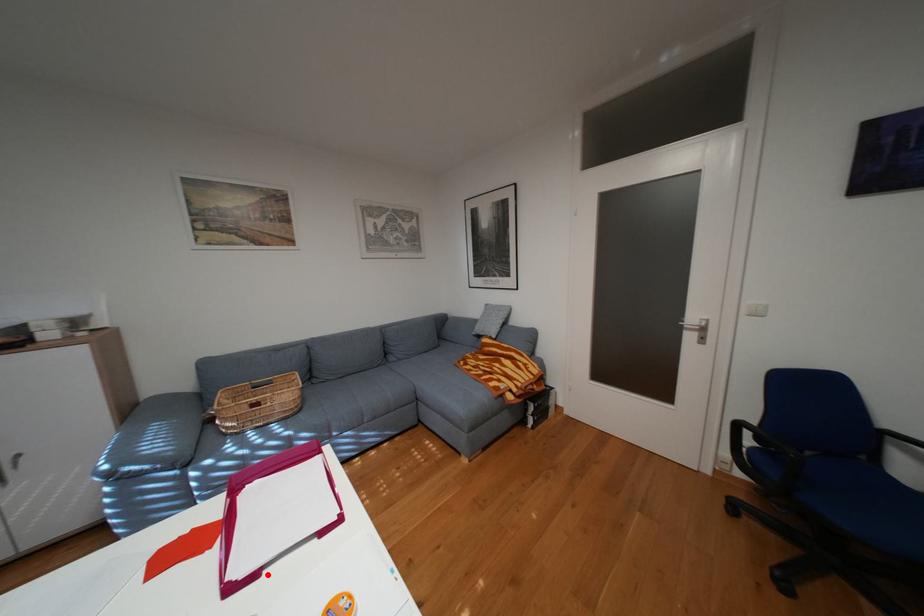
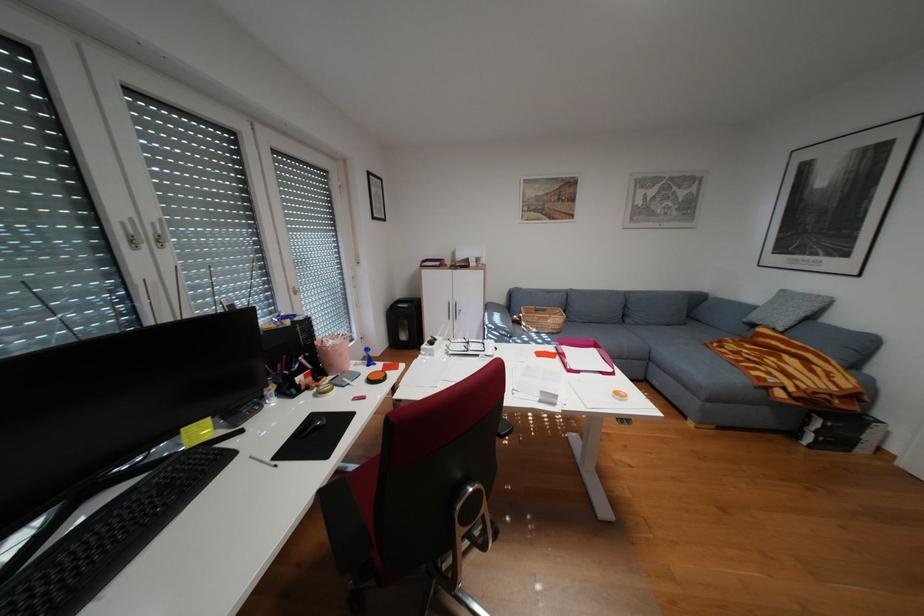
Locate, in the second image, the point that corresponds to the highlighted location in the first image.

(590, 371)